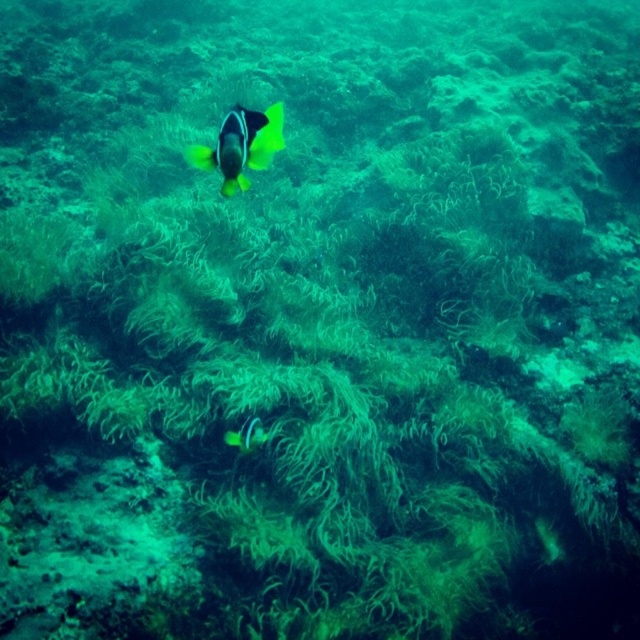
Question: Which point is closer to the camera?

Choices:
 (A) yellow matte fish at center
 (B) bright yellow and black fish at center

Answer: (A)

Question: Can you confirm if yellow matte fish at center is positioned above bright yellow and black fish at center?

Choices:
 (A) yes
 (B) no

Answer: (A)

Question: In this image, where is yellow matte fish at center located relative to bright yellow and black fish at center?

Choices:
 (A) left
 (B) right

Answer: (B)

Question: Which object appears closest to the camera in this image?

Choices:
 (A) yellow matte fish at center
 (B) bright yellow and black fish at center

Answer: (A)

Question: Which point is farther to the camera?

Choices:
 (A) bright yellow and black fish at center
 (B) yellow matte fish at center

Answer: (A)

Question: Does yellow matte fish at center appear on the right side of bright yellow and black fish at center?

Choices:
 (A) no
 (B) yes

Answer: (B)